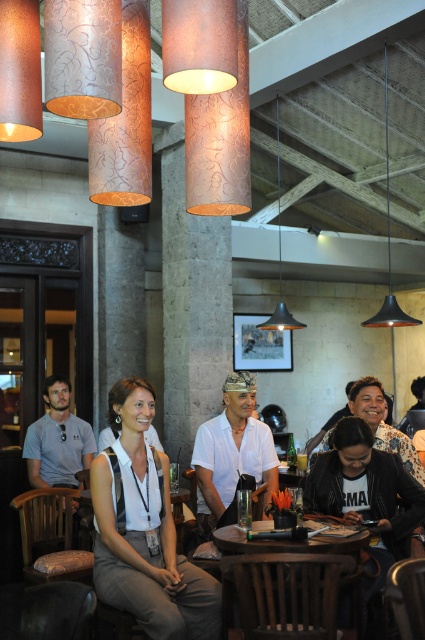
You are a photographer positioned behind the group at the round table. You want to capture a photo where the gray cotton shirt at left is clearly visible without being blocked by the metallic pendant light at center. Based on the scene description, is this possible?

The gray cotton shirt at left is in front of the metallic pendant light at center, so it will block the light. Therefore, the photographer cannot capture a photo where the gray cotton shirt at left is clearly visible without being blocked by the metallic pendant light at center.

You are standing at the entrance of the cafe and see two points marked in the scene. The first point is at coordinates point (306, 522) and the second is at point (388, 202). Which point is closer to you?

Point (306, 522) is in front of point (388, 202), so it is closer to you.

In the scene, there is a point marked at coordinates (57, 440). What object is located at this point?

The gray cotton shirt at left is located at point (57, 440).